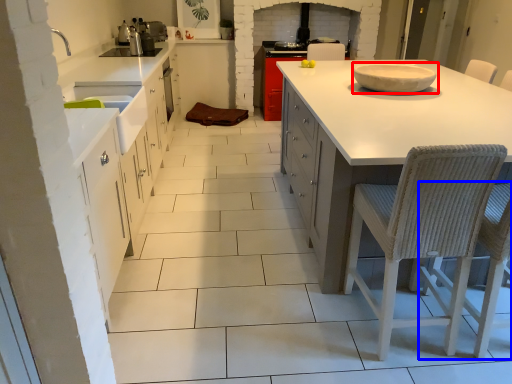
Question: Which of the following is the farthest to the observer, bowl (highlighted by a red box) or chair (highlighted by a blue box)?

Choices:
 (A) bowl
 (B) chair

Answer: (A)